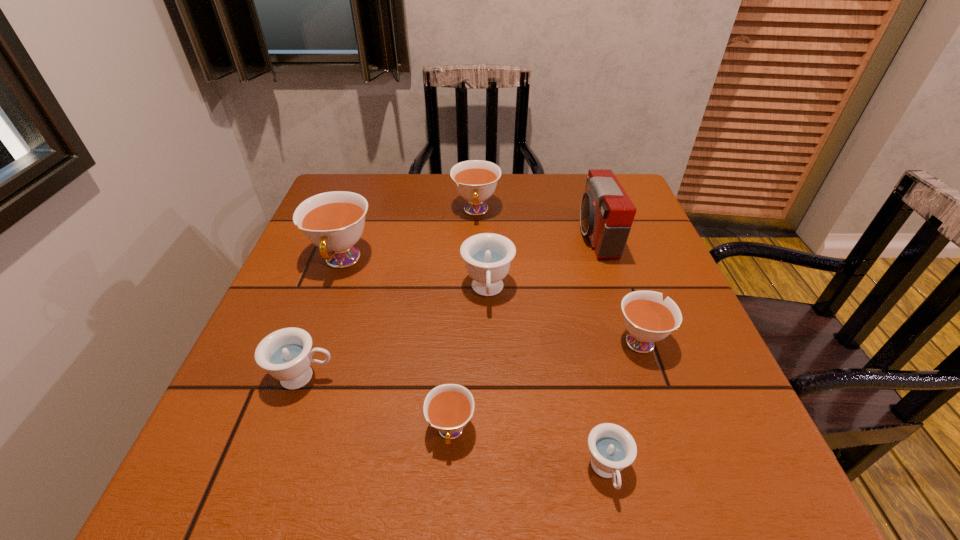
Find the location of a particular element. free space that satisfies the following two spatial constraints: 1. on the side of the second blue teacup from left to right with the handle; 2. on the side of the second nearest blue teacup with the handle is located at coordinates (489, 377).